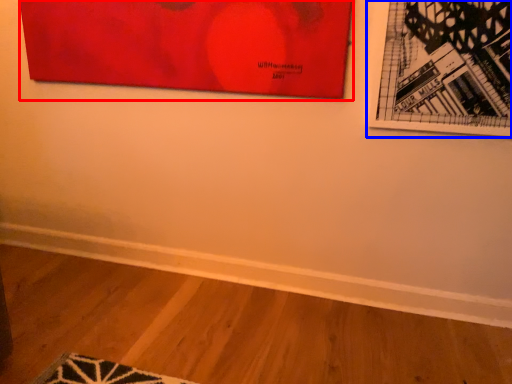
Question: Which point is further to the camera, picture frame (highlighted by a red box) or picture frame (highlighted by a blue box)?

Choices:
 (A) picture frame
 (B) picture frame

Answer: (A)